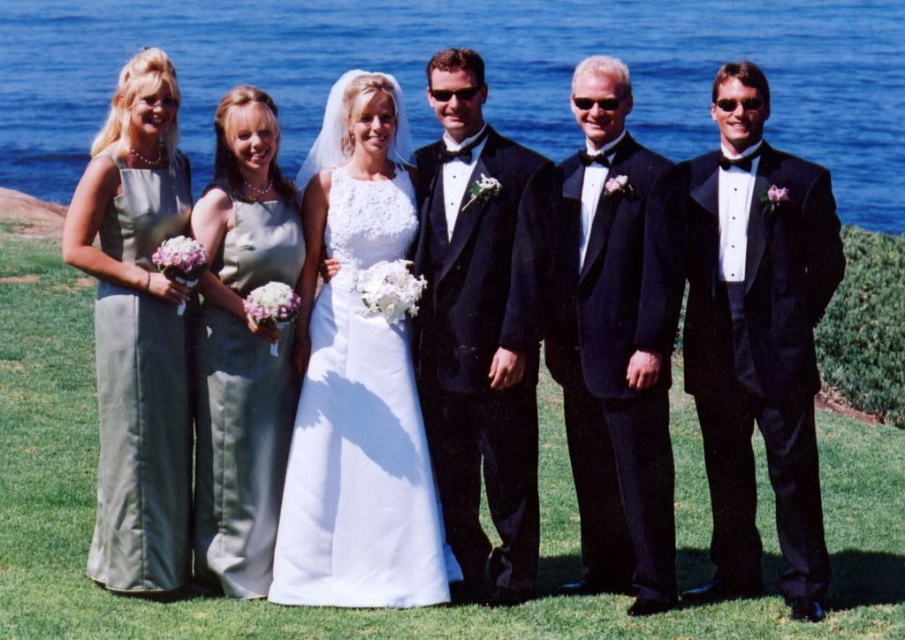
Question: Can you confirm if black satin tuxedo at right is thinner than black satin tuxedo at center?

Choices:
 (A) yes
 (B) no

Answer: (B)

Question: Which of the following is the farthest from the observer?

Choices:
 (A) (767, 310)
 (B) (374, 324)
 (C) (577, 502)

Answer: (C)

Question: Which object is farther from the camera taking this photo?

Choices:
 (A) black satin tuxedo at right
 (B) satin black tuxedo at center

Answer: (B)

Question: Which object is farther from the camera taking this photo?

Choices:
 (A) satin dress at center
 (B) satin black tuxedo at center

Answer: (A)

Question: Can you confirm if blue water at upper center is positioned below black satin tuxedo at right?

Choices:
 (A) no
 (B) yes

Answer: (A)

Question: Can you confirm if blue water at upper center is bigger than black satin tuxedo at center?

Choices:
 (A) yes
 (B) no

Answer: (A)